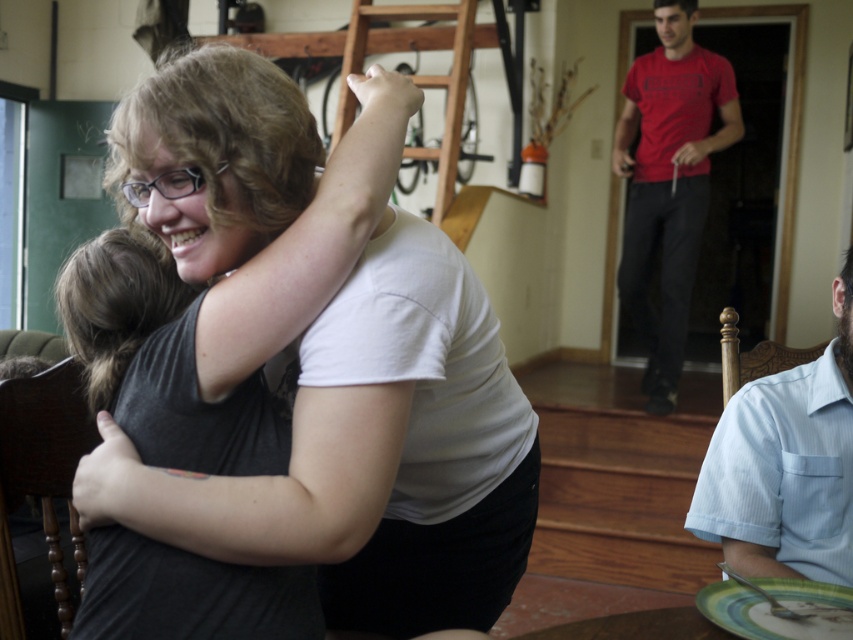
Question: Where is white matte t-shirt at center located in relation to light blue striped shirt at lower right in the image?

Choices:
 (A) left
 (B) right

Answer: (A)

Question: Can you confirm if light blue striped shirt at lower right is wider than red cotton t-shirt at right?

Choices:
 (A) no
 (B) yes

Answer: (A)

Question: Which point is closer to the camera taking this photo?

Choices:
 (A) (740, 509)
 (B) (643, 84)

Answer: (A)

Question: Is white matte t-shirt at center wider than red cotton t-shirt at right?

Choices:
 (A) no
 (B) yes

Answer: (B)

Question: Among these objects, which one is farthest from the camera?

Choices:
 (A) light blue striped shirt at lower right
 (B) green glazed plate at lower right
 (C) white matte t-shirt at center
 (D) red cotton t-shirt at right

Answer: (D)

Question: Which point is closer to the camera?

Choices:
 (A) light blue striped shirt at lower right
 (B) green glazed plate at lower right
 (C) white matte t-shirt at center

Answer: (C)